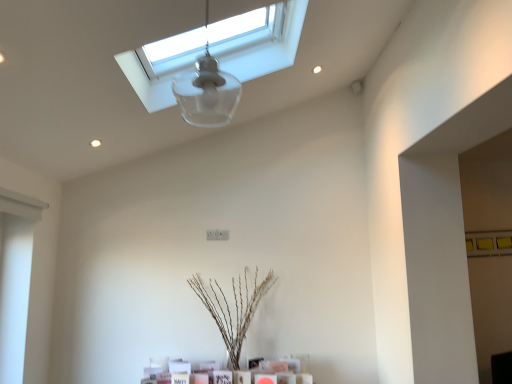
Question: Is transparent glass lampshade at upper center positioned with its back to brown textured plant at center?

Choices:
 (A) no
 (B) yes

Answer: (A)

Question: Considering the relative sizes of transparent glass lampshade at upper center and brown textured plant at center in the image provided, is transparent glass lampshade at upper center thinner than brown textured plant at center?

Choices:
 (A) yes
 (B) no

Answer: (A)

Question: Does transparent glass lampshade at upper center lie behind brown textured plant at center?

Choices:
 (A) yes
 (B) no

Answer: (B)

Question: Can you confirm if transparent glass lampshade at upper center is taller than brown textured plant at center?

Choices:
 (A) no
 (B) yes

Answer: (A)

Question: Can you confirm if transparent glass lampshade at upper center is wider than brown textured plant at center?

Choices:
 (A) no
 (B) yes

Answer: (A)

Question: From a real-world perspective, is transparent glass lampshade at upper center positioned above or below brown textured plant at center?

Choices:
 (A) above
 (B) below

Answer: (A)

Question: From their relative heights in the image, would you say transparent glass lampshade at upper center is taller or shorter than brown textured plant at center?

Choices:
 (A) short
 (B) tall

Answer: (A)

Question: Considering their positions, is transparent glass lampshade at upper center located in front of or behind brown textured plant at center?

Choices:
 (A) front
 (B) behind

Answer: (A)

Question: Is transparent glass lampshade at upper center inside the boundaries of brown textured plant at center, or outside?

Choices:
 (A) inside
 (B) outside

Answer: (B)

Question: Looking at their shapes, would you say transparent glass window at upper center is wider or thinner than transparent glass lampshade at upper center?

Choices:
 (A) thin
 (B) wide

Answer: (B)

Question: Is transparent glass window at upper center inside or outside of transparent glass lampshade at upper center?

Choices:
 (A) inside
 (B) outside

Answer: (B)

Question: Considering the positions of point (256, 64) and point (198, 79), is point (256, 64) closer or farther from the camera than point (198, 79)?

Choices:
 (A) farther
 (B) closer

Answer: (A)

Question: Relative to transparent glass lampshade at upper center, is transparent glass window at upper center in front or behind?

Choices:
 (A) behind
 (B) front

Answer: (A)

Question: From a real-world perspective, relative to transparent glass window at upper center, is brown textured plant at center vertically above or below?

Choices:
 (A) above
 (B) below

Answer: (B)

Question: Considering the positions of brown textured plant at center and transparent glass window at upper center in the image, is brown textured plant at center taller or shorter than transparent glass window at upper center?

Choices:
 (A) tall
 (B) short

Answer: (A)